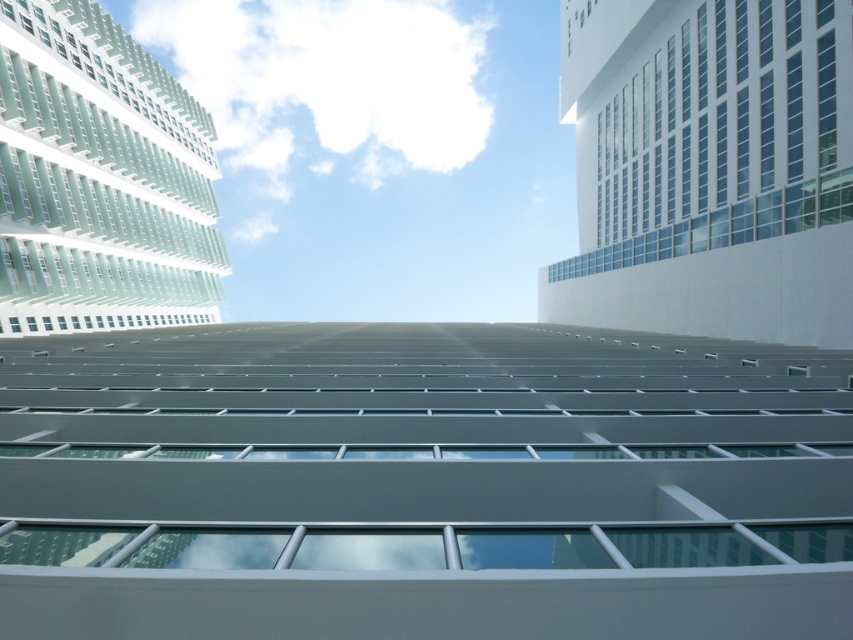
Question: Is white fluffy cloud at upper center closer to camera compared to white fluffy cloud at center?

Choices:
 (A) no
 (B) yes

Answer: (A)

Question: Does white fluffy cloud at upper center appear under white fluffy cloud at center?

Choices:
 (A) yes
 (B) no

Answer: (B)

Question: Which point is farther to the camera?

Choices:
 (A) white fluffy cloud at center
 (B) white fluffy cloud at upper center

Answer: (B)

Question: Is white fluffy cloud at upper center bigger than white fluffy cloud at center?

Choices:
 (A) no
 (B) yes

Answer: (B)

Question: Among these objects, which one is farthest from the camera?

Choices:
 (A) white fluffy cloud at upper center
 (B) white fluffy cloud at center

Answer: (A)